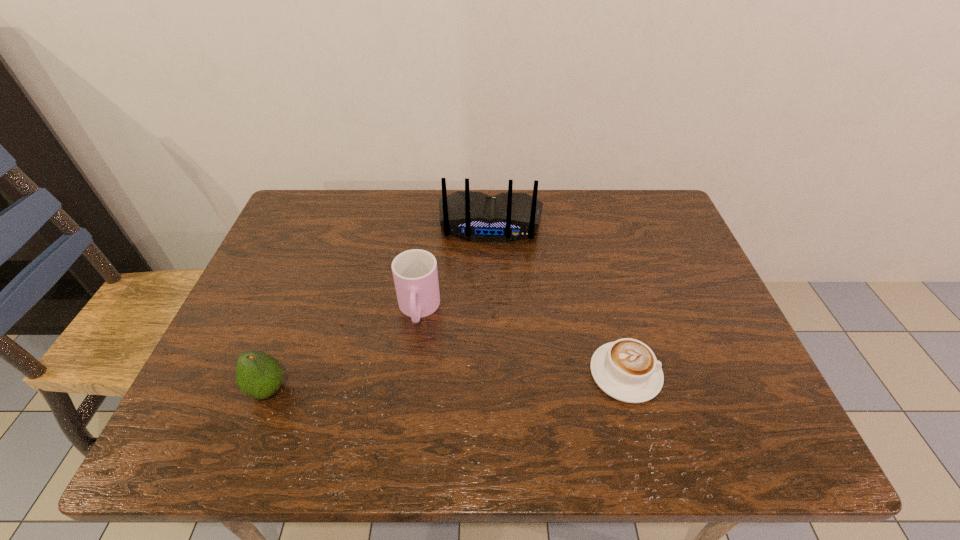
Identify the location of vacant point at the near edge. (393, 377).

Identify the location of vacant space at the left edge of the desktop. The height and width of the screenshot is (540, 960). (263, 340).

In the image, there is a desktop. At what (x,y) coordinates should I click in order to perform the action: click on blank space at the right edge. Please return your answer as a coordinate pair (x, y). The width and height of the screenshot is (960, 540). Looking at the image, I should click on (734, 356).

In the image, there is a desktop. At what (x,y) coordinates should I click in order to perform the action: click on vacant space at the far left corner. Please return your answer as a coordinate pair (x, y). The width and height of the screenshot is (960, 540). Looking at the image, I should click on coord(302,228).

This screenshot has height=540, width=960. I want to click on free space at the far right corner of the desktop, so click(x=635, y=222).

This screenshot has height=540, width=960. I want to click on free space at the near right corner, so click(718, 390).

Locate an element on the screen. blank region between the second farthest object and the router is located at coordinates (455, 267).

Where is `free spot between the tallest object and the cup`? The width and height of the screenshot is (960, 540). free spot between the tallest object and the cup is located at coordinates (455, 267).

The image size is (960, 540). I want to click on empty location between the avocado and the tallest object, so click(x=379, y=307).

Image resolution: width=960 pixels, height=540 pixels. I want to click on free space between the avocado and the shortest object, so click(x=446, y=381).